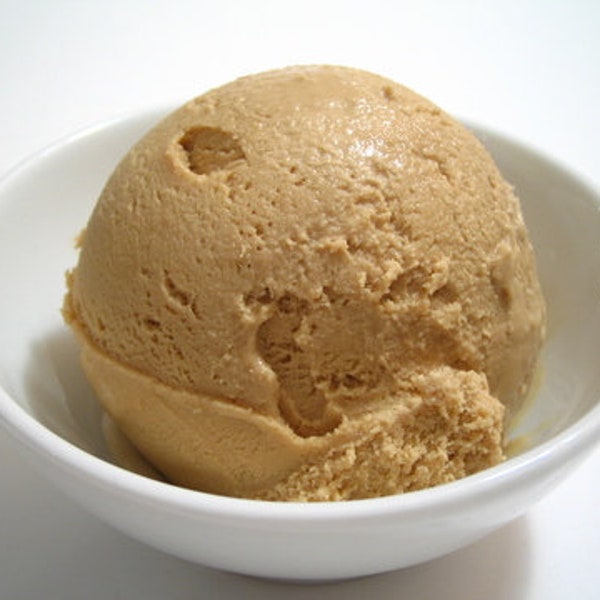
Locate an element on the screen. The height and width of the screenshot is (600, 600). light gray color in background is located at coordinates (22, 35).